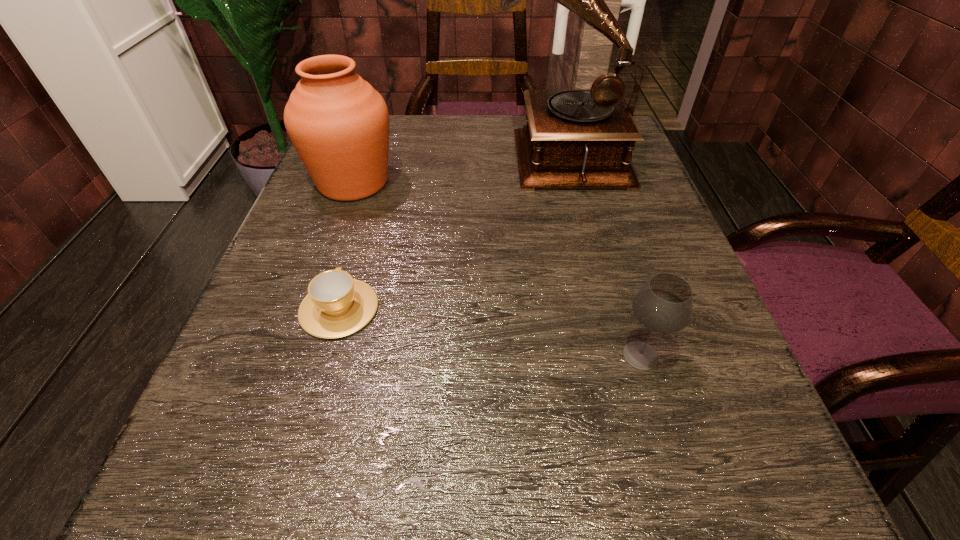
The height and width of the screenshot is (540, 960). Identify the location of free region at the far edge of the desktop. (407, 118).

Identify the location of free space at the near edge of the desktop. (622, 477).

In the image, there is a desktop. Find the location of `vacant space at the left edge`. vacant space at the left edge is located at coordinates coord(330,201).

What are the coordinates of `free spot at the right edge of the desktop` in the screenshot? It's located at (621, 288).

Identify the location of free space at the near right corner of the desktop. The image size is (960, 540). (667, 462).

The height and width of the screenshot is (540, 960). I want to click on vacant space that's between the third tallest object and the urn, so click(497, 269).

Where is `empty space between the urn and the record player`? empty space between the urn and the record player is located at coordinates (457, 168).

Find the location of `free space between the shortest object and the urn`. free space between the shortest object and the urn is located at coordinates (347, 246).

Locate an element on the screen. This screenshot has height=540, width=960. vacant region between the cup and the second tallest object is located at coordinates (347, 246).

The width and height of the screenshot is (960, 540). In order to click on vacant space in between the shortest object and the urn in this screenshot , I will do `click(347, 246)`.